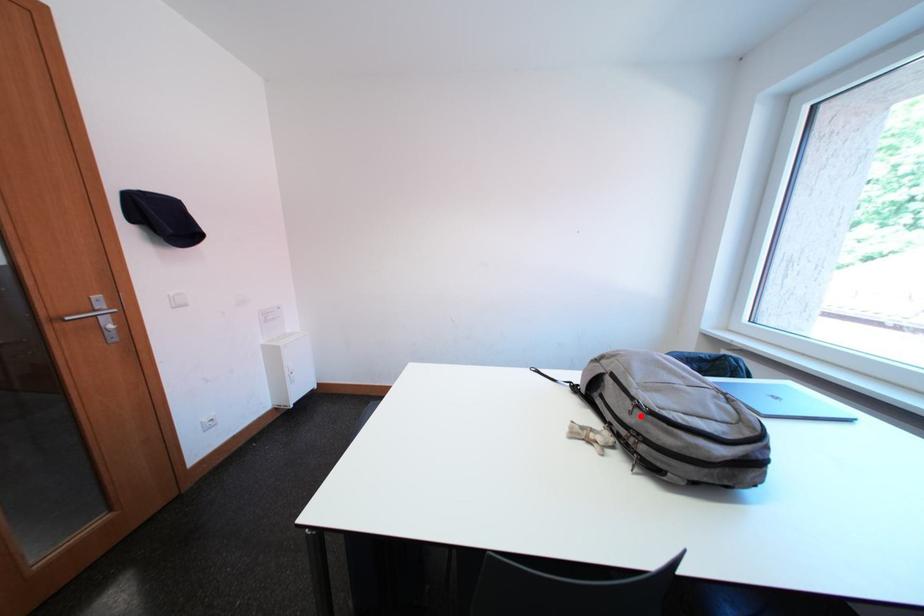
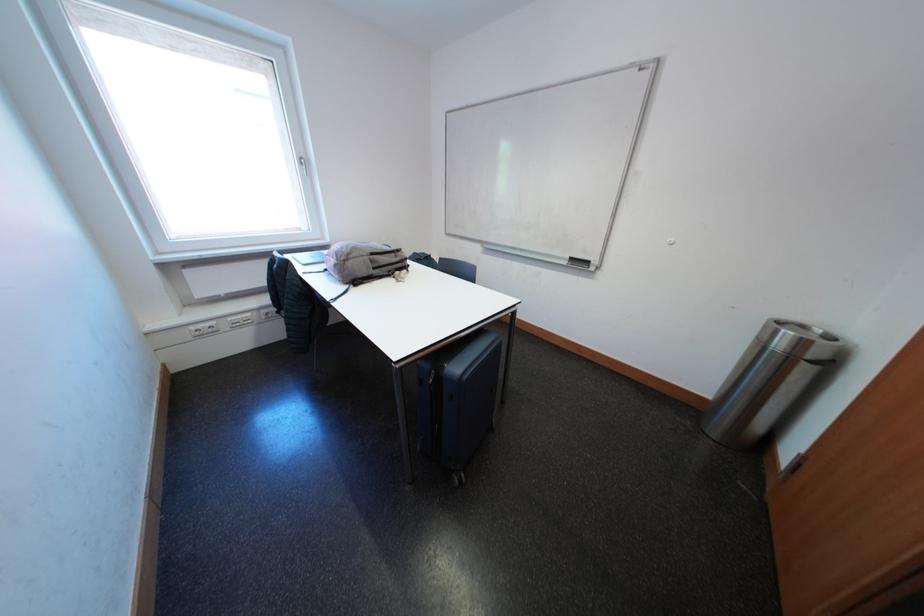
Locate, in the second image, the point that corresponds to the highlighted location in the first image.

(406, 261)